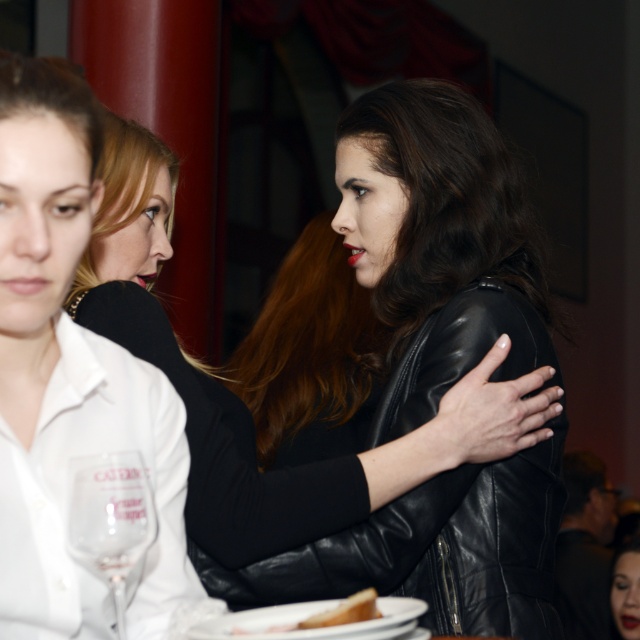
You are a guest at the event and want to reach the transparent glass at lower left without disturbing the matte black jacket at upper center. Is there a way to do this?

The matte black jacket at upper center is positioned over the transparent glass at lower left, so you cannot reach the transparent glass at lower left without moving the matte black jacket at upper center first.

You are a guest at this event and want to take a photo of the wine glass and the plate. The wine glass is at point (420, 445) and the plate is at point (129, 515). If you stand in front of both points, which one will block the view of the other?

Point (420, 445) is behind point (129, 515), so the plate at point (129, 515) will block the view of the wine glass at point (420, 445).